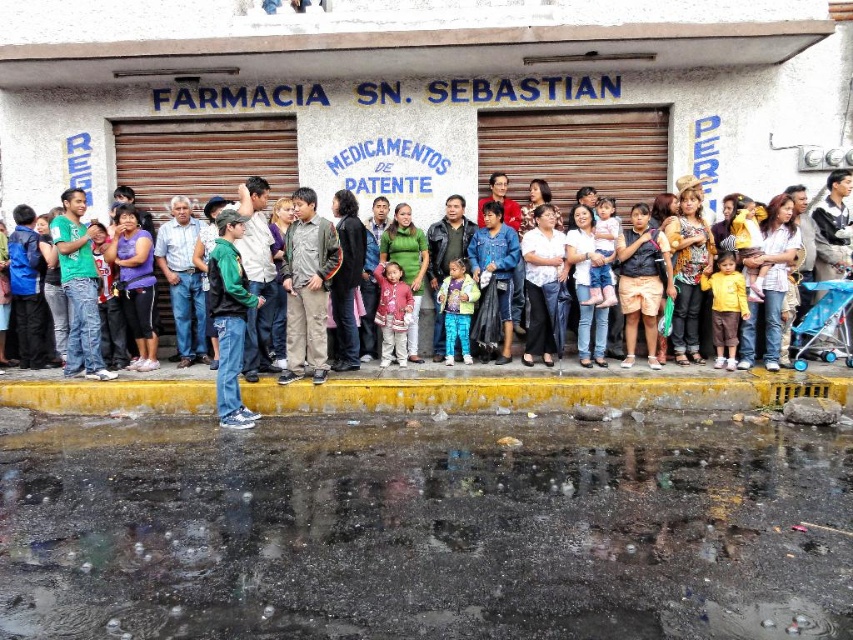
Question: Which of the following is the farthest from the observer?

Choices:
 (A) (402, 339)
 (B) (325, 234)
 (C) (193, 385)

Answer: (A)

Question: Which is farther from the green matte jacket at center?

Choices:
 (A) matte black shirt at center
 (B) white cotton shirt at center
 (C) yellow concrete curb at lower center

Answer: (C)

Question: Can you confirm if jeans at center is thinner than matte black shirt at center?

Choices:
 (A) no
 (B) yes

Answer: (B)

Question: Is glossy asphalt puddle at lower center wider than matte black shirt at center?

Choices:
 (A) no
 (B) yes

Answer: (B)

Question: Where is jeans at center located in relation to matte black shirt at center in the image?

Choices:
 (A) above
 (B) below

Answer: (B)

Question: Which is nearer to the green matte jacket at center?

Choices:
 (A) ripped denim jacket at center
 (B) matte pink sweater at center
 (C) jeans at center
 (D) glossy asphalt puddle at lower center

Answer: (A)